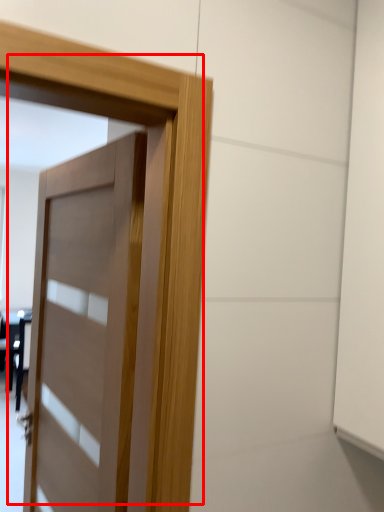
Question: From the image's perspective, where is door (annotated by the red box) located in relation to table in the image?

Choices:
 (A) below
 (B) above

Answer: (B)